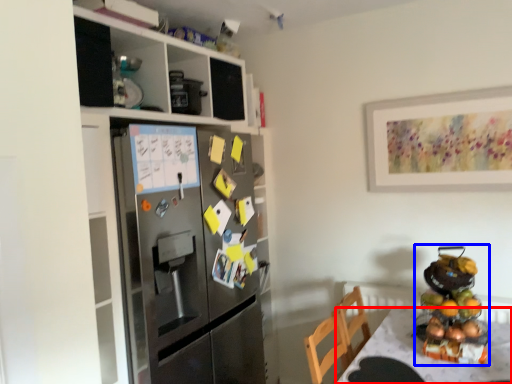
Question: Which of the following is the farthest to the observer, desk (highlighted by a red box) or appliance (highlighted by a blue box)?

Choices:
 (A) desk
 (B) appliance

Answer: (B)